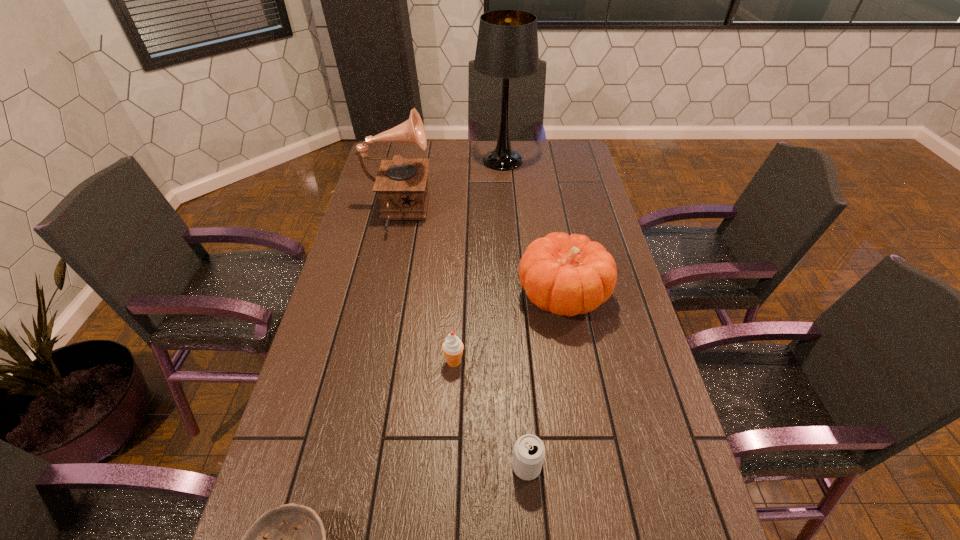
The width and height of the screenshot is (960, 540). Find the location of `free region located 0.240m on the left of the farthest object`. free region located 0.240m on the left of the farthest object is located at coordinates pos(418,160).

Identify the location of free space located on the horn of the fifth nearest object. This screenshot has width=960, height=540. (494, 213).

Where is `free point located on the front of the pumpkin`? Image resolution: width=960 pixels, height=540 pixels. free point located on the front of the pumpkin is located at coordinates (578, 378).

I want to click on free space located 0.260m on the right of the third shortest object, so click(564, 362).

Identify the location of blank space located on the right of the can. The image size is (960, 540). (564, 467).

This screenshot has height=540, width=960. Identify the location of object that is at the far edge. (507, 46).

This screenshot has width=960, height=540. In order to click on object that is at the left edge in this screenshot , I will do `click(401, 183)`.

Locate an element on the screen. object located at the right edge is located at coordinates (567, 275).

In the image, there is a desktop. At what (x,y) coordinates should I click in order to perform the action: click on vacant space at the far edge. Please return your answer as a coordinate pair (x, y). This screenshot has width=960, height=540. Looking at the image, I should click on (418, 152).

This screenshot has width=960, height=540. In order to click on free space at the left edge of the desktop in this screenshot , I will do `click(320, 438)`.